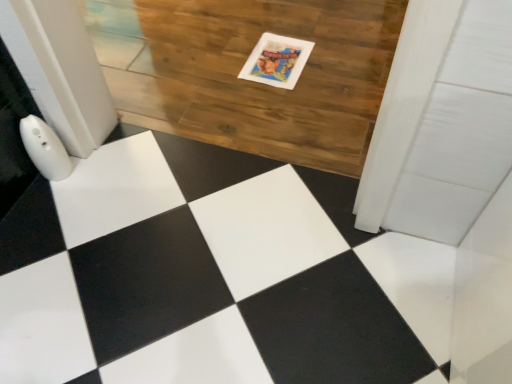
The height and width of the screenshot is (384, 512). Find the location of `free space behind matte paper postcard at upper center`. free space behind matte paper postcard at upper center is located at coordinates (273, 24).